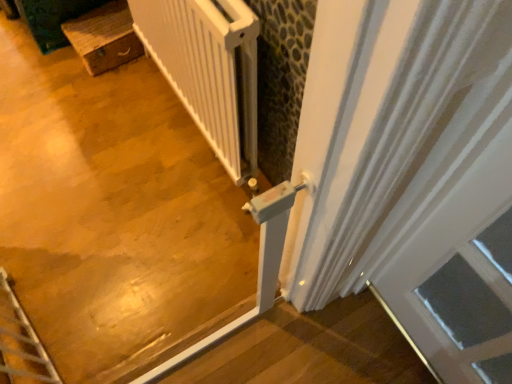
Locate an element on the screen. The width and height of the screenshot is (512, 384). free spot below white matte radiator at center (from a real-world perspective) is located at coordinates (188, 125).